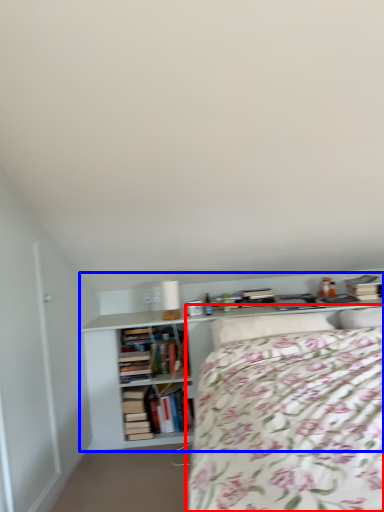
Question: Which of the following is the closest to the observer, bed (highlighted by a red box) or shelf (highlighted by a blue box)?

Choices:
 (A) bed
 (B) shelf

Answer: (A)